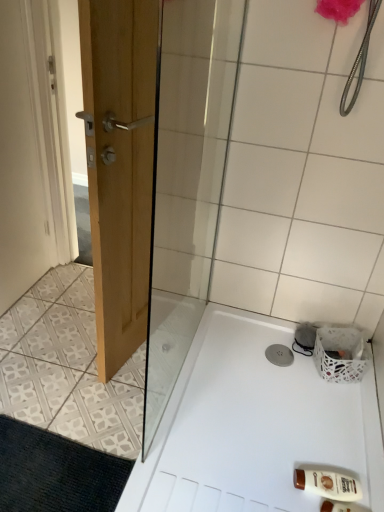
Question: Is black textured bath mat at lower left completely or partially inside brown plastic bottle at lower right?

Choices:
 (A) yes
 (B) no

Answer: (B)

Question: Is brown plastic bottle at lower right in front of black textured bath mat at lower left?

Choices:
 (A) no
 (B) yes

Answer: (A)

Question: Does brown plastic bottle at lower right turn towards black textured bath mat at lower left?

Choices:
 (A) yes
 (B) no

Answer: (A)

Question: Is the position of brown plastic bottle at lower right more distant than that of black textured bath mat at lower left?

Choices:
 (A) yes
 (B) no

Answer: (A)

Question: Is brown plastic bottle at lower right shorter than black textured bath mat at lower left?

Choices:
 (A) no
 (B) yes

Answer: (A)

Question: Does point (327, 419) appear closer or farther from the camera than point (304, 480)?

Choices:
 (A) closer
 (B) farther

Answer: (B)

Question: Is white plastic bath at lower right inside the boundaries of brown plastic bottle at lower right, or outside?

Choices:
 (A) outside
 (B) inside

Answer: (A)

Question: From a real-world perspective, is white plastic bath at lower right physically located above or below brown plastic bottle at lower right?

Choices:
 (A) below
 (B) above

Answer: (A)

Question: Looking at the image, does white plastic bath at lower right seem bigger or smaller compared to brown plastic bottle at lower right?

Choices:
 (A) small
 (B) big

Answer: (B)

Question: Is white plastic bath at lower right spatially inside black textured bath mat at lower left, or outside of it?

Choices:
 (A) inside
 (B) outside

Answer: (B)

Question: From their relative heights in the image, would you say white plastic bath at lower right is taller or shorter than black textured bath mat at lower left?

Choices:
 (A) short
 (B) tall

Answer: (B)

Question: Is white plastic bath at lower right in front of or behind black textured bath mat at lower left in the image?

Choices:
 (A) behind
 (B) front

Answer: (B)

Question: From a real-world perspective, is white plastic bath at lower right positioned above or below black textured bath mat at lower left?

Choices:
 (A) above
 (B) below

Answer: (B)

Question: From their relative heights in the image, would you say white woven basket at lower right is taller or shorter than brown plastic bottle at lower right?

Choices:
 (A) short
 (B) tall

Answer: (B)

Question: Does point (345, 348) appear closer or farther from the camera than point (324, 490)?

Choices:
 (A) closer
 (B) farther

Answer: (B)